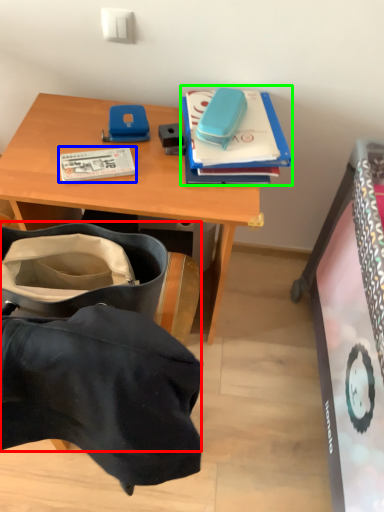
Question: Which object is the closest to the luggage and bags (highlighted by a red box)? Choose among these: book (highlighted by a blue box) or book (highlighted by a green box).

Choices:
 (A) book
 (B) book

Answer: (A)